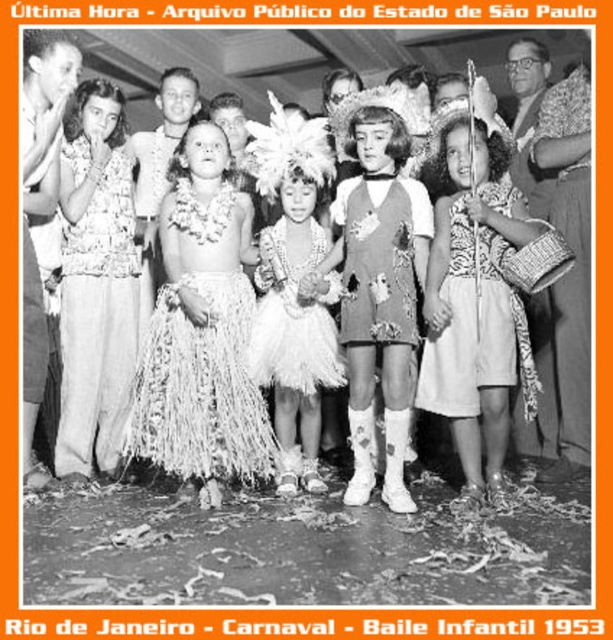
Question: Which point is farther from the camera taking this photo?

Choices:
 (A) (128, 376)
 (B) (414, 145)
 (C) (262, 193)

Answer: (A)

Question: Can you confirm if matte lace blouse at center is positioned below white feathered headdress at center?

Choices:
 (A) no
 (B) yes

Answer: (A)

Question: Among these points, which one is nearest to the camera?

Choices:
 (A) (259, 164)
 (B) (527, 339)

Answer: (B)

Question: Is white grass skirt at center above natural fiber skirt at center?

Choices:
 (A) yes
 (B) no

Answer: (A)

Question: Does white grass skirt at center have a lesser width compared to white fringed skirt at center?

Choices:
 (A) yes
 (B) no

Answer: (B)

Question: Which object is closer to the camera taking this photo?

Choices:
 (A) white cotton dress at center
 (B) natural fiber skirt at center

Answer: (A)